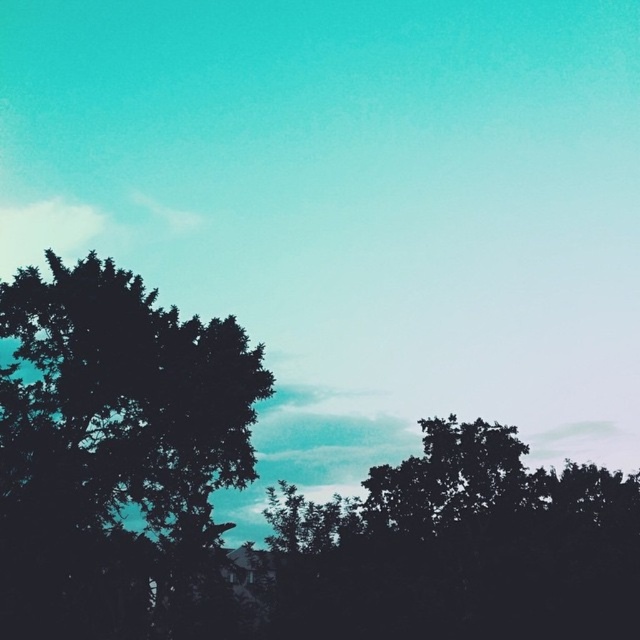
You are an observer standing in front of the trees. Which tree, the dark green leafy tree at left or the silhouette leafy tree at center, reaches higher into the sky?

The dark green leafy tree at left is taller than the silhouette leafy tree at center, so it reaches higher into the sky.

Looking at this image, you are standing in a field and see the dark green leafy tree at left and the silhouette leafy tree at center. Which tree is positioned higher in the sky?

The dark green leafy tree at left is positioned higher in the sky than the silhouette leafy tree at center.